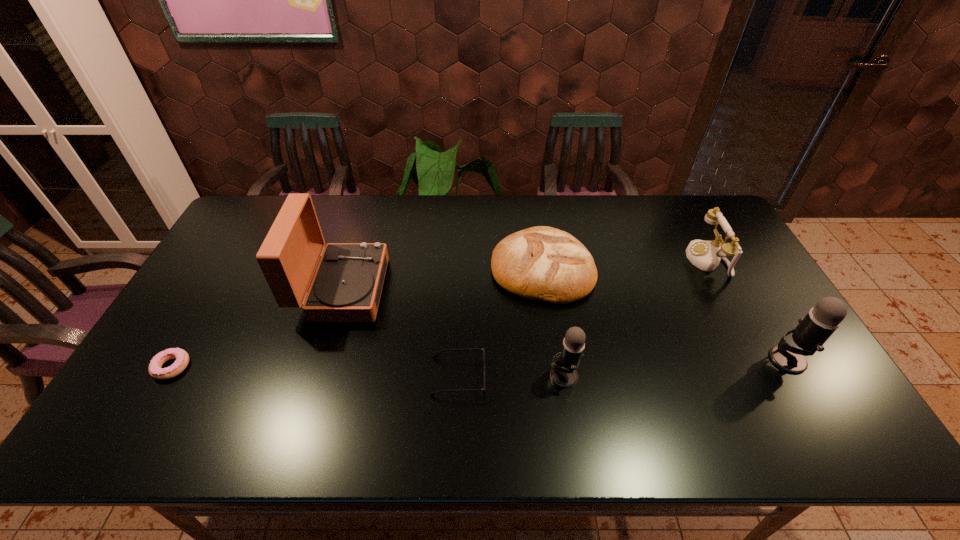
Where is `vacant space that is in between the fifth object from right to left and the fifth tallest object`? This screenshot has width=960, height=540. vacant space that is in between the fifth object from right to left and the fifth tallest object is located at coordinates (500, 323).

At what (x,y) coordinates should I click in order to perform the action: click on object that is the second nearest to the spectacles. Please return your answer as a coordinate pair (x, y). Looking at the image, I should click on (543, 263).

Where is `object that can be found as the fourth closest to the doughnut`? The height and width of the screenshot is (540, 960). object that can be found as the fourth closest to the doughnut is located at coordinates (563, 373).

Locate an element on the screen. free space that satisfies the following two spatial constraints: 1. on the face of the phonograph record; 2. on the right side of the taller microphone is located at coordinates (322, 359).

Where is `vacant space that satisfies the following two spatial constraints: 1. on the back side of the third tallest object; 2. on the face of the sixth object from right to left`? The width and height of the screenshot is (960, 540). vacant space that satisfies the following two spatial constraints: 1. on the back side of the third tallest object; 2. on the face of the sixth object from right to left is located at coordinates (550, 289).

Identify the location of vacant space that satisfies the following two spatial constraints: 1. on the face of the phonograph record; 2. on the back side of the left microphone. (317, 375).

Find the location of a particular element. This screenshot has width=960, height=540. free space that satisfies the following two spatial constraints: 1. on the face of the phonograph record; 2. on the back side of the left microphone is located at coordinates (317, 375).

You are a GUI agent. You are given a task and a screenshot of the screen. Output one action in this format:
    pyautogui.click(x=<x>, y=<y>)
    Task: Click on the vacant space that satisfies the following two spatial constraints: 1. on the front side of the bread; 2. on the left side of the taller microphone
    Image resolution: width=960 pixels, height=540 pixels.
    Given the screenshot: What is the action you would take?
    pyautogui.click(x=556, y=359)